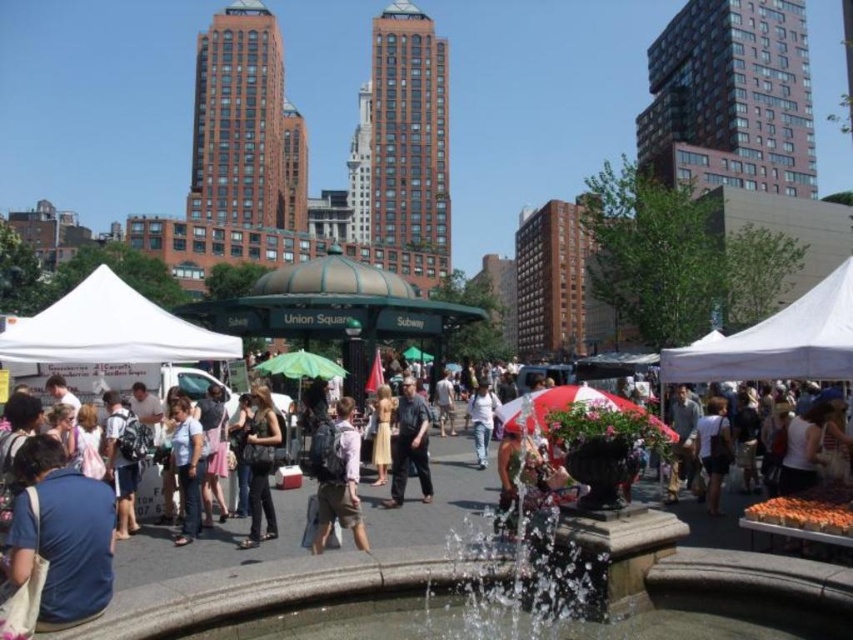
You are a photographer standing at the fountain in Union Square. You want to take a photo of both the dark gray shirt at center and the white cotton shirt at center. Which shirt should you focus on first to ensure both are in frame?

You should focus on the dark gray shirt at center first since it is taller than the white cotton shirt at center, ensuring it fits within the frame while capturing both.

You are a photographer trying to capture both the dark gray shirt at center and the white cotton shirt at center in a single frame. Given their sizes, which shirt would you need to position closer to the camera to ensure both fit in the frame?

The dark gray shirt at center is wider than the white cotton shirt at center. To fit both in the frame, position the wider dark gray shirt at center closer to the camera so that its larger size can be accommodated while keeping the white cotton shirt at center further back.